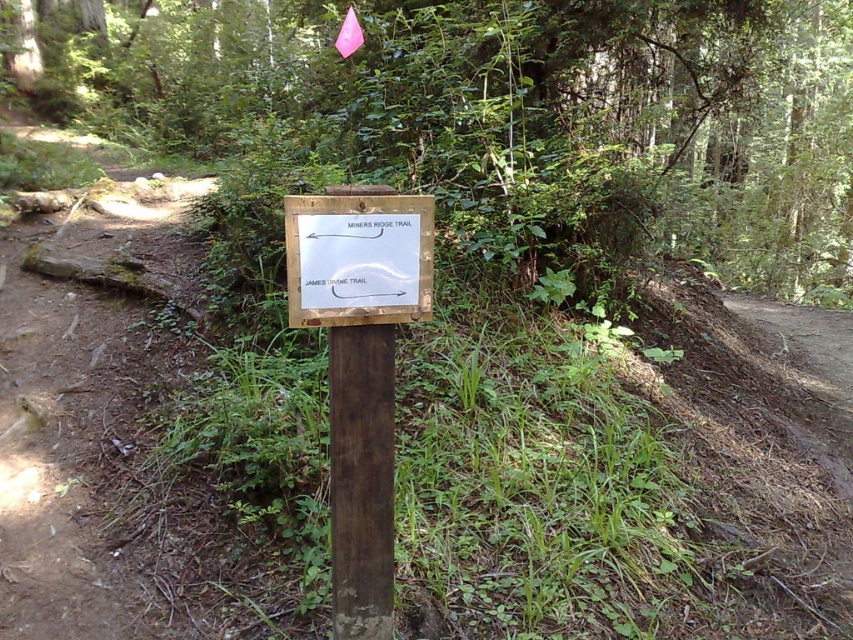
In the scene shown: You are a hiker who wants to read the trail directions on the brown wooden signpost at center. However, there is a dark brown wood at center blocking your view. Can you see the signpost clearly?

The dark brown wood at center is behind the brown wooden signpost at center, so the signpost is in front and you can see it clearly without obstruction.

You are a hiker trying to read both the brown wooden signpost at center and the white paper sign at center. Since you have a limited view, which one do you think you can read more clearly?

The brown wooden signpost at center is larger in size than the white paper sign at center, so you can read the brown wooden signpost at center more clearly.

You are a hiker trying to read the trail directions. You notice two items at the center of your view. Which object is physically wider, the brown wooden signpost at center or the white paper sign at center?

The brown wooden signpost at center is wider than the white paper sign at center according to the description.